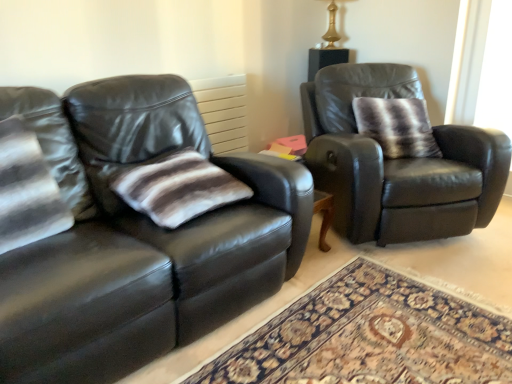
Question: From the image's perspective, is matte black leather armchair at right under matte black couch at left?

Choices:
 (A) no
 (B) yes

Answer: (A)

Question: Is matte black leather armchair at right not inside matte black couch at left?

Choices:
 (A) no
 (B) yes

Answer: (B)

Question: Is matte black leather armchair at right facing towards matte black couch at left?

Choices:
 (A) yes
 (B) no

Answer: (B)

Question: Is matte black leather armchair at right closer to camera compared to matte black couch at left?

Choices:
 (A) no
 (B) yes

Answer: (A)

Question: Is matte black couch at left a part of matte black leather armchair at right?

Choices:
 (A) no
 (B) yes

Answer: (A)

Question: Is matte black leather armchair at right shorter than matte black couch at left?

Choices:
 (A) yes
 (B) no

Answer: (A)

Question: Considering the relative positions of striped fur pillow at right, marked as the 1th pillow in a back-to-front arrangement, and gold metallic table lamp at upper center in the image provided, is striped fur pillow at right, marked as the 1th pillow in a back-to-front arrangement, in front of gold metallic table lamp at upper center?

Choices:
 (A) no
 (B) yes

Answer: (B)

Question: Is striped fur pillow at right, acting as the first pillow starting from the top, at the right side of gold metallic table lamp at upper center?

Choices:
 (A) no
 (B) yes

Answer: (B)

Question: From a real-world perspective, does striped fur pillow at right, which ranks as the second pillow in bottom-to-top order, sit lower than gold metallic table lamp at upper center?

Choices:
 (A) no
 (B) yes

Answer: (B)

Question: Does striped fur pillow at right, arranged as the second pillow when viewed from the front, have a greater height compared to gold metallic table lamp at upper center?

Choices:
 (A) no
 (B) yes

Answer: (B)

Question: Does striped fur pillow at right, the 1th pillow when ordered from right to left, have a greater width compared to gold metallic table lamp at upper center?

Choices:
 (A) yes
 (B) no

Answer: (B)

Question: Is gold metallic table lamp at upper center located within striped fur pillow at right, the 1th pillow when ordered from right to left?

Choices:
 (A) no
 (B) yes

Answer: (A)

Question: From the image's perspective, is striped fabric pillow at center, the 1th pillow viewed from the front, beneath gold metallic table lamp at upper center?

Choices:
 (A) yes
 (B) no

Answer: (A)